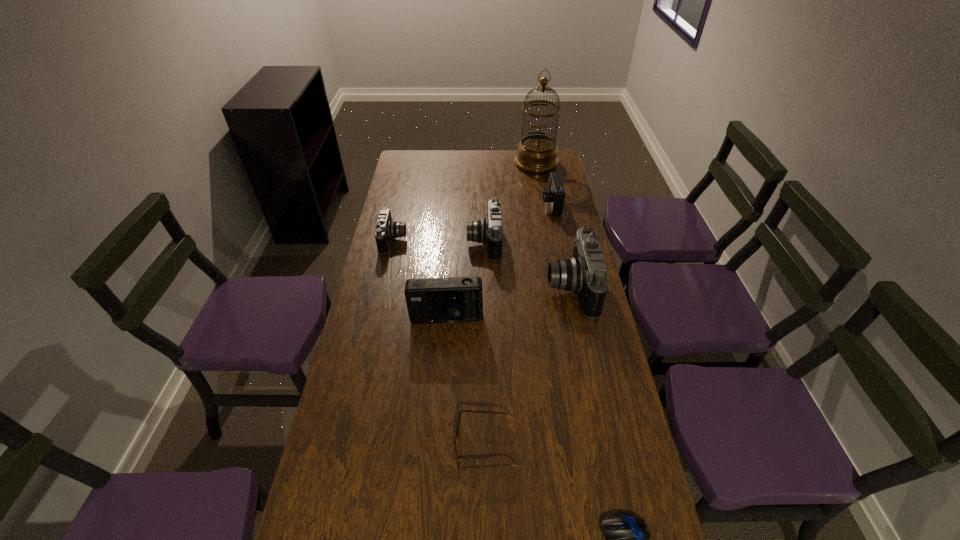
Locate an element on the screen. vacant space that's between the tallest object and the tallest camera is located at coordinates (553, 226).

At what (x,y) coordinates should I click in order to perform the action: click on object that is the closest to the seventh tallest object. Please return your answer as a coordinate pair (x, y). Image resolution: width=960 pixels, height=540 pixels. Looking at the image, I should click on (627, 536).

Image resolution: width=960 pixels, height=540 pixels. I want to click on the fifth closest object to the right blue camera, so click(452, 300).

Select which camera is the fifth closest to the shortest object. Please provide its 2D coordinates. Your answer should be formatted as a tuple, i.e. [(x, y)], where the tuple contains the x and y coordinates of a point satisfying the conditions above.

[(555, 194)]

Identify which camera is the third closest to the nearer blue camera. Please provide its 2D coordinates. Your answer should be formatted as a tuple, i.e. [(x, y)], where the tuple contains the x and y coordinates of a point satisfying the conditions above.

[(386, 229)]

Select which black camera is the closest to the leftmost object. Please provide its 2D coordinates. Your answer should be formatted as a tuple, i.e. [(x, y)], where the tuple contains the x and y coordinates of a point satisfying the conditions above.

[(484, 231)]

The height and width of the screenshot is (540, 960). Identify the location of black camera that is the second closest to the nearer blue camera. (484, 231).

Find the location of a particular element. free spot that satisfies the following two spatial constraints: 1. on the front-facing side of the second black camera from left to right; 2. on the front-facing side of the bigger blue camera is located at coordinates (485, 322).

At what (x,y) coordinates should I click in order to perform the action: click on free location that satisfies the following two spatial constraints: 1. with an open door on the birdcage; 2. on the front-facing side of the second black camera from left to right. Please return your answer as a coordinate pair (x, y). Image resolution: width=960 pixels, height=540 pixels. Looking at the image, I should click on (550, 242).